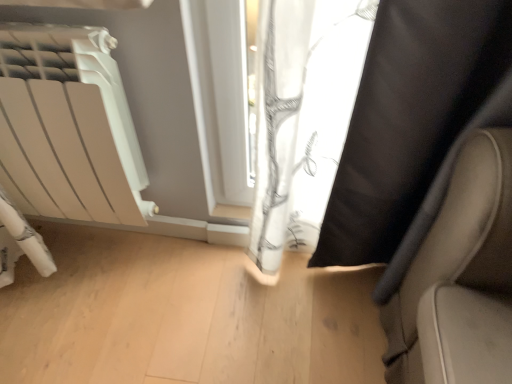
Locate an element on the screen. white matte radiator at left is located at coordinates (69, 126).

What do you see at coordinates (69, 126) in the screenshot? This screenshot has width=512, height=384. I see `white matte radiator at left` at bounding box center [69, 126].

Measure the distance between white matte radiator at left and camera.

The depth of white matte radiator at left is 80.54 centimeters.

This screenshot has width=512, height=384. Find the location of `white matte radiator at left`. white matte radiator at left is located at coordinates (69, 126).